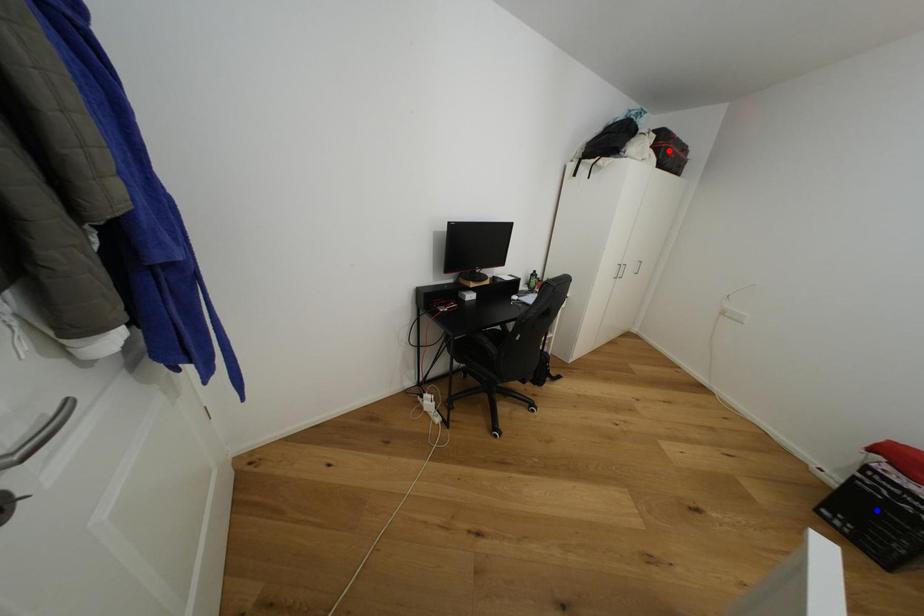
Question: In the image, two points are highlighted. Which point is nearer to the camera? Reply with the corresponding letter.

Choices:
 (A) blue point
 (B) red point

Answer: (A)